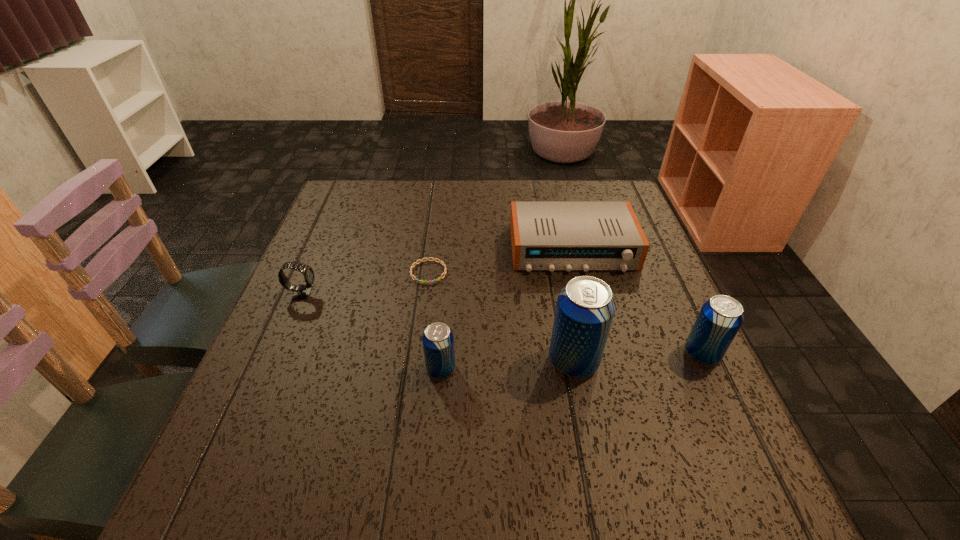
Where is `free space at the near edge of the desktop`? Image resolution: width=960 pixels, height=540 pixels. free space at the near edge of the desktop is located at coordinates (482, 432).

Identify the location of vacant space at the left edge. (288, 311).

Where is `vacant point at the right edge`? The width and height of the screenshot is (960, 540). vacant point at the right edge is located at coordinates (624, 327).

The image size is (960, 540). Find the location of `vacant space at the far left corner`. vacant space at the far left corner is located at coordinates (380, 180).

Locate an element on the screen. The height and width of the screenshot is (540, 960). free space at the far right corner of the desktop is located at coordinates (574, 187).

The image size is (960, 540). In order to click on free location at the near right corner in this screenshot , I will do `click(724, 405)`.

Locate an element on the screen. The image size is (960, 540). vacant space that's between the radio receiver and the shortest beer can is located at coordinates (507, 308).

The height and width of the screenshot is (540, 960). In order to click on vacant space that is in between the fifth shortest object and the fourth nearest object in this screenshot , I will do `click(502, 323)`.

Locate an element on the screen. The width and height of the screenshot is (960, 540). free space between the tallest object and the second shortest beer can is located at coordinates (637, 357).

Where is `vacant area that lies between the leftmost object and the shortest object`? This screenshot has height=540, width=960. vacant area that lies between the leftmost object and the shortest object is located at coordinates (366, 283).